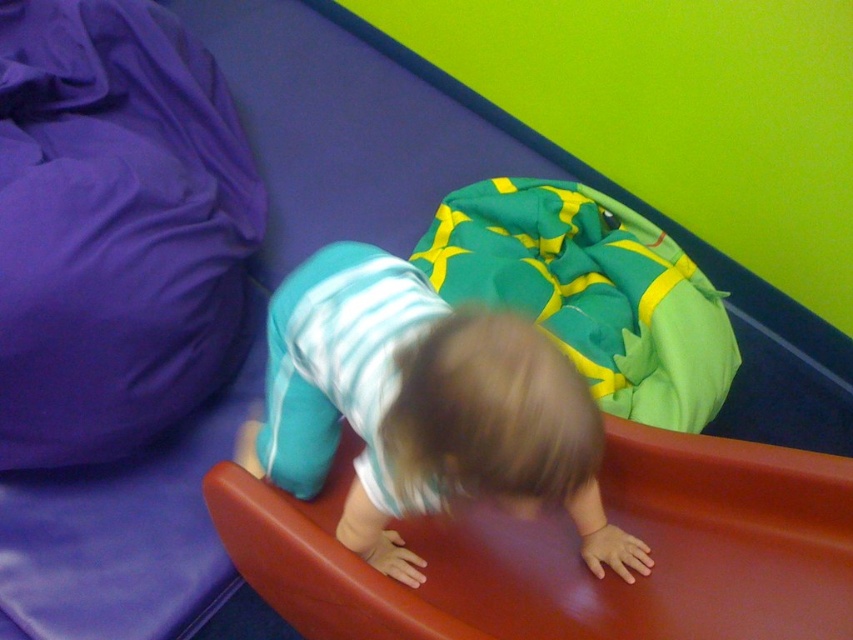
Question: Does smooth red slide at lower center appear on the left side of teal striped shirt at center?

Choices:
 (A) yes
 (B) no

Answer: (B)

Question: Which object appears closest to the camera in this image?

Choices:
 (A) smooth red slide at lower center
 (B) teal striped shirt at center

Answer: (B)

Question: Where is smooth red slide at lower center located in relation to teal striped shirt at center in the image?

Choices:
 (A) left
 (B) right

Answer: (B)

Question: Where is smooth red slide at lower center located in relation to teal striped shirt at center in the image?

Choices:
 (A) right
 (B) left

Answer: (A)